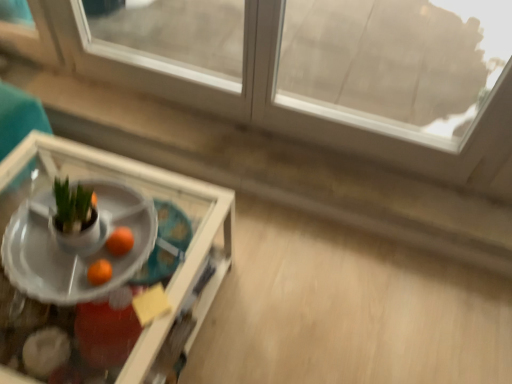
Question: Does transparent glass window at upper center have a smaller size compared to white glossy tray at center, which is counted as the second table, starting from the front?

Choices:
 (A) no
 (B) yes

Answer: (A)

Question: Can you confirm if transparent glass window at upper center is wider than white glossy tray at center, which is counted as the second table, starting from the front?

Choices:
 (A) yes
 (B) no

Answer: (B)

Question: Is the position of transparent glass window at upper center less distant than that of white glossy tray at center, which is counted as the second table, starting from the front?

Choices:
 (A) yes
 (B) no

Answer: (B)

Question: Can you confirm if transparent glass window at upper center is positioned to the left of white glossy tray at center, which is the first table from back to front?

Choices:
 (A) no
 (B) yes

Answer: (A)

Question: Is transparent glass window at upper center positioned behind white glossy tray at center, which is the first table from back to front?

Choices:
 (A) no
 (B) yes

Answer: (B)

Question: Is transparent glass window at upper center facing away from white glossy tray at center, which is counted as the second table, starting from the front?

Choices:
 (A) yes
 (B) no

Answer: (A)

Question: From the image's perspective, is white glossy tray at center, which is the first table from back to front, located beneath orange matte at center?

Choices:
 (A) no
 (B) yes

Answer: (A)

Question: Are white glossy tray at center, which is the first table from back to front, and orange matte at center making contact?

Choices:
 (A) no
 (B) yes

Answer: (A)

Question: Is white glossy tray at center, which is counted as the second table, starting from the front, taller than orange matte at center?

Choices:
 (A) yes
 (B) no

Answer: (A)

Question: Does white glossy tray at center, which is the first table from back to front, have a lesser width compared to orange matte at center?

Choices:
 (A) no
 (B) yes

Answer: (A)

Question: Does white glossy tray at center, which is the first table from back to front, have a greater width compared to orange matte at center?

Choices:
 (A) no
 (B) yes

Answer: (B)

Question: Is white glossy tray at center, which is the first table from back to front, to the left of orange matte at center from the viewer's perspective?

Choices:
 (A) no
 (B) yes

Answer: (B)

Question: Is clear glass tray at lower left, the second table from the back, turned away from orange matte at center?

Choices:
 (A) no
 (B) yes

Answer: (A)